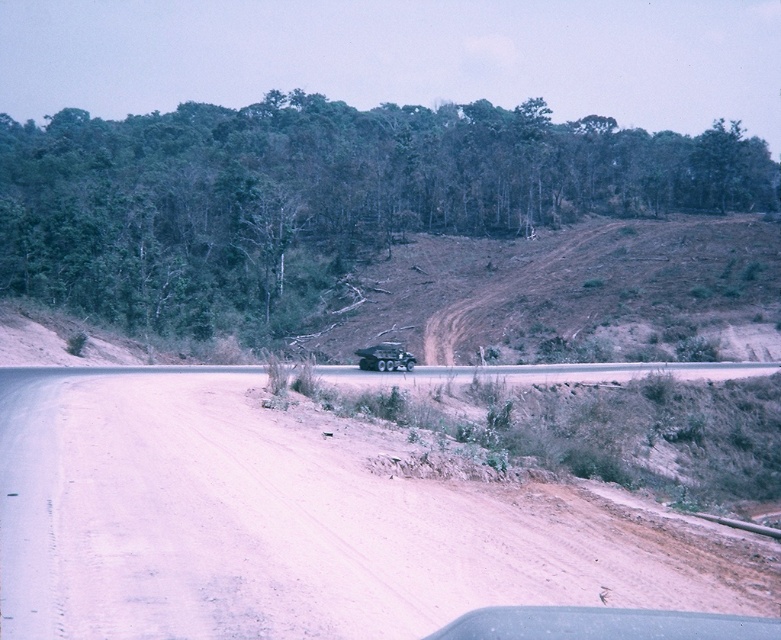
Question: Does dusty sand road at center come in front of metallic green jeep at center?

Choices:
 (A) no
 (B) yes

Answer: (B)

Question: Is dusty sand road at center further to camera compared to green leafy tree at center?

Choices:
 (A) yes
 (B) no

Answer: (B)

Question: Which object appears closest to the camera in this image?

Choices:
 (A) green leafy tree at center
 (B) metallic green jeep at center
 (C) dusty sand road at center

Answer: (C)

Question: Which of these objects is positioned closest to the metallic green jeep at center?

Choices:
 (A) green leafy tree at center
 (B) dusty sand road at center

Answer: (B)

Question: Which point is closer to the camera?

Choices:
 (A) (212, 116)
 (B) (16, 502)

Answer: (B)

Question: Does green leafy tree at center appear on the left side of metallic green jeep at center?

Choices:
 (A) yes
 (B) no

Answer: (A)